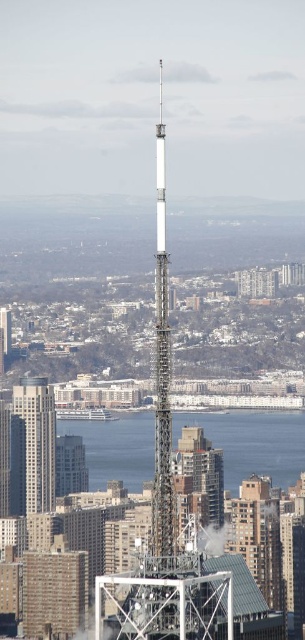
Does clear water at center have a greater height compared to matte glass skyscraper at center?

In fact, clear water at center may be shorter than matte glass skyscraper at center.

Which is below, clear water at center or matte glass skyscraper at center?

clear water at center is lower down.

You are a GUI agent. You are given a task and a screenshot of the screen. Output one action in this format:
    pyautogui.click(x=<x>, y=<y>)
    Task: Click on the clear water at center
    
    Given the screenshot: What is the action you would take?
    pyautogui.click(x=253, y=442)